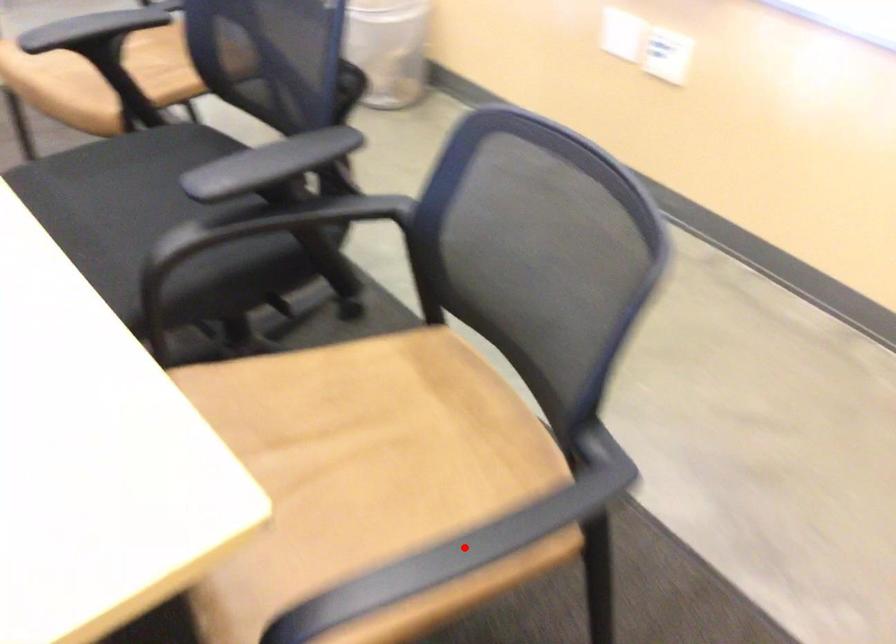
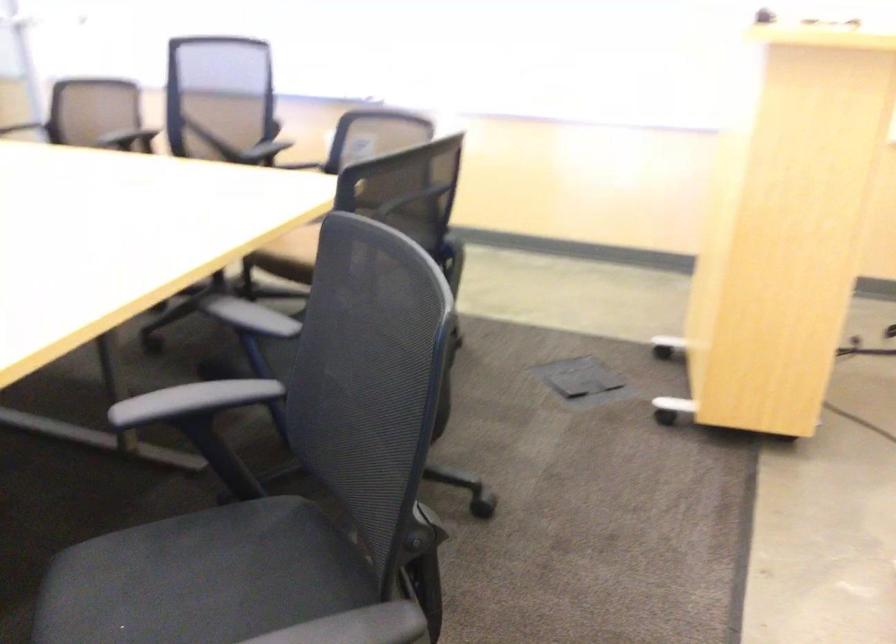
Question: I am providing you with two images of the same scene from different viewpoints. A red point is marked on the first image. At the location where the point appears in image 1, is it still visible in image 2?

Choices:
 (A) Yes
 (B) No

Answer: (B)